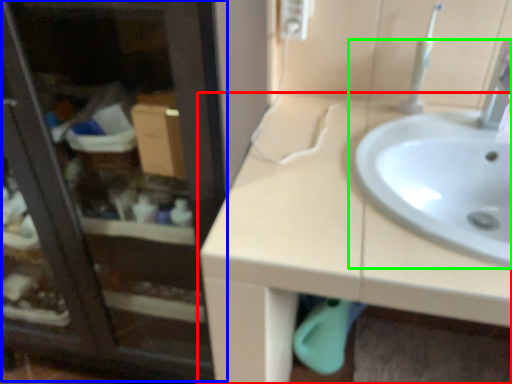
Question: Which object is positioned closest to countertop (highlighted by a red box)? Select from screen door (highlighted by a blue box) and sink (highlighted by a green box).

Choices:
 (A) screen door
 (B) sink

Answer: (B)